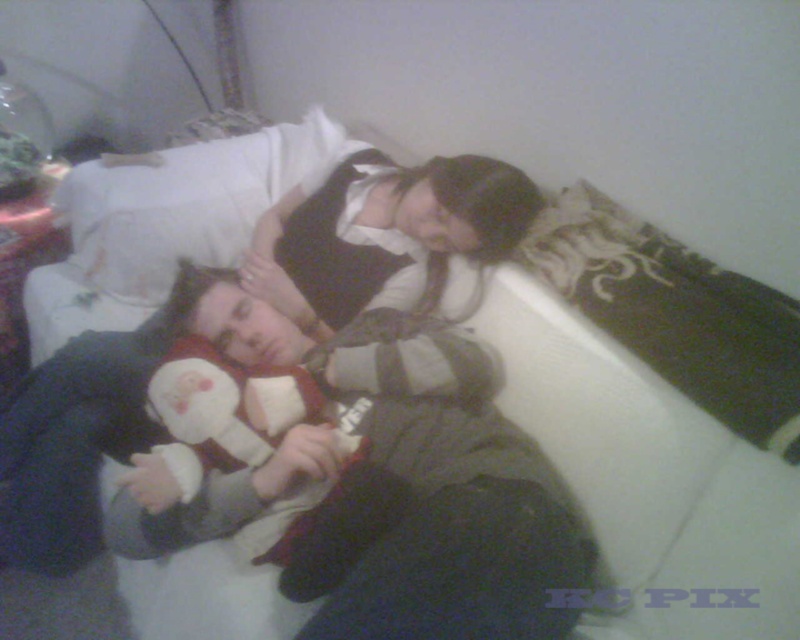
You are a photographer setting up a shoot in this bedroom scene. You need to place a small prop between the soft gray sweater at center and the white soft pillow at upper center. Based on their positions, where should you place the prop so it sits between them?

The soft gray sweater at center is below the white soft pillow at upper center, so placing the prop between them would require positioning it above the sweater and below the pillow to maintain their spatial relationship.

You are taking a photo of the two people on the bed. You want to focus on the person closer to the camera. Which point should you focus on, point (297, 484) or point (162, 157)?

You should focus on point (297, 484) because it is closer to the camera than point (162, 157).